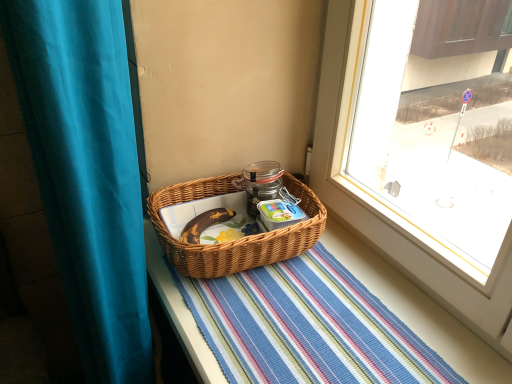
Locate an element on the screen. empty space that is ontop of striped woven mat at center is located at coordinates (315, 312).